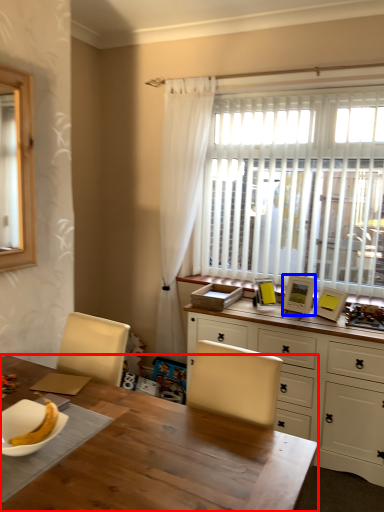
Question: Which object is closer to the camera taking this photo, desk (highlighted by a red box) or picture frame (highlighted by a blue box)?

Choices:
 (A) desk
 (B) picture frame

Answer: (A)